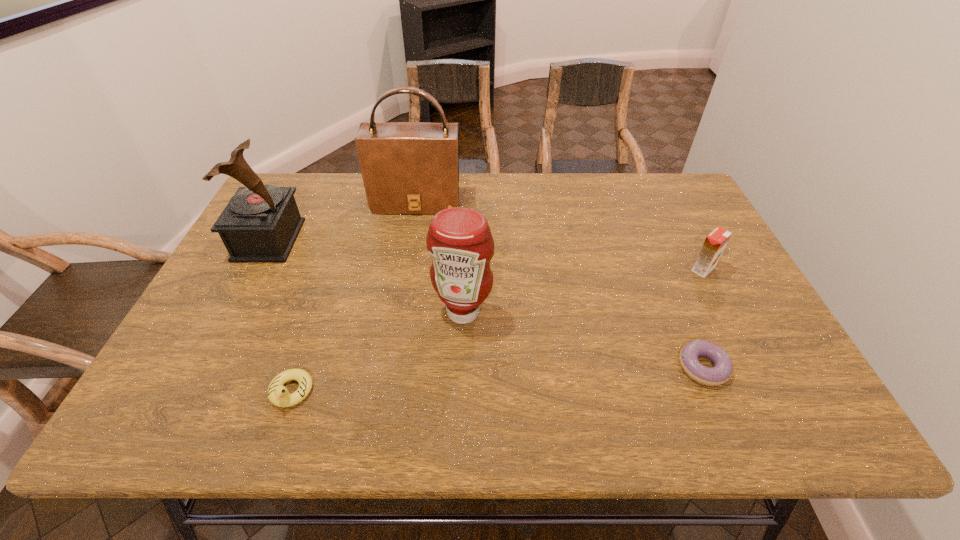
Locate an element on the screen. This screenshot has height=540, width=960. shoulder bag is located at coordinates (407, 167).

Locate an element on the screen. The width and height of the screenshot is (960, 540). the leftmost object is located at coordinates (260, 224).

Locate an element on the screen. the fourth farthest object is located at coordinates (459, 240).

I want to click on the third shortest object, so click(715, 243).

You are a GUI agent. You are given a task and a screenshot of the screen. Output one action in this format:
    pyautogui.click(x=<x>, y=<y>)
    Task: Click on the orange juice
    The image size is (960, 540).
    Given the screenshot: What is the action you would take?
    pyautogui.click(x=715, y=243)

Where is `duckling`? This screenshot has width=960, height=540. duckling is located at coordinates (278, 395).

Locate an element on the screen. The image size is (960, 540). the fifth object from right to left is located at coordinates (278, 395).

Locate an element on the screen. This screenshot has height=540, width=960. the second object from right to left is located at coordinates (723, 367).

Locate an element on the screen. The image size is (960, 540). doughnut is located at coordinates (723, 367).

Find the location of a particular element. Image resolution: width=960 pixels, height=540 pixels. vacant area located 0.370m on the front flap of the shoulder bag is located at coordinates (398, 308).